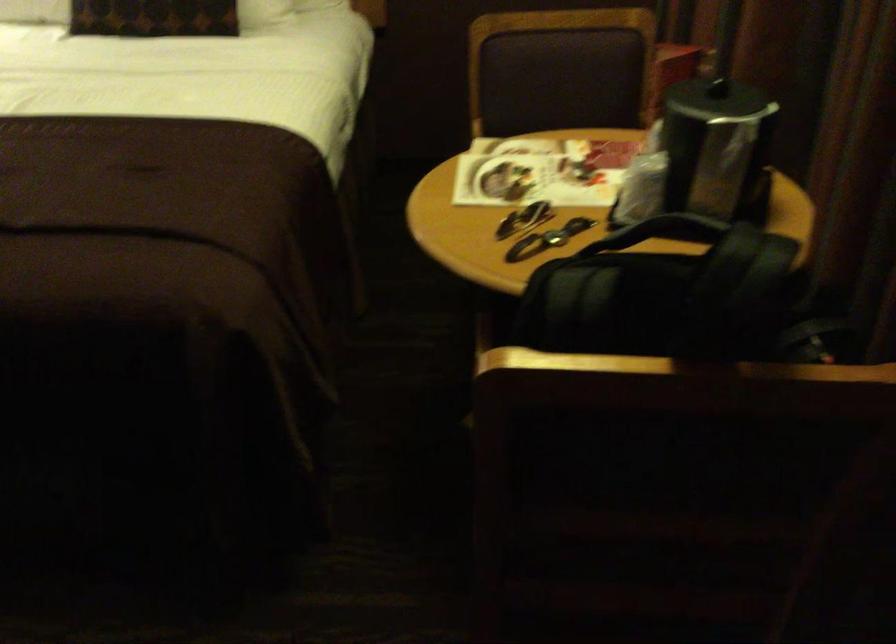
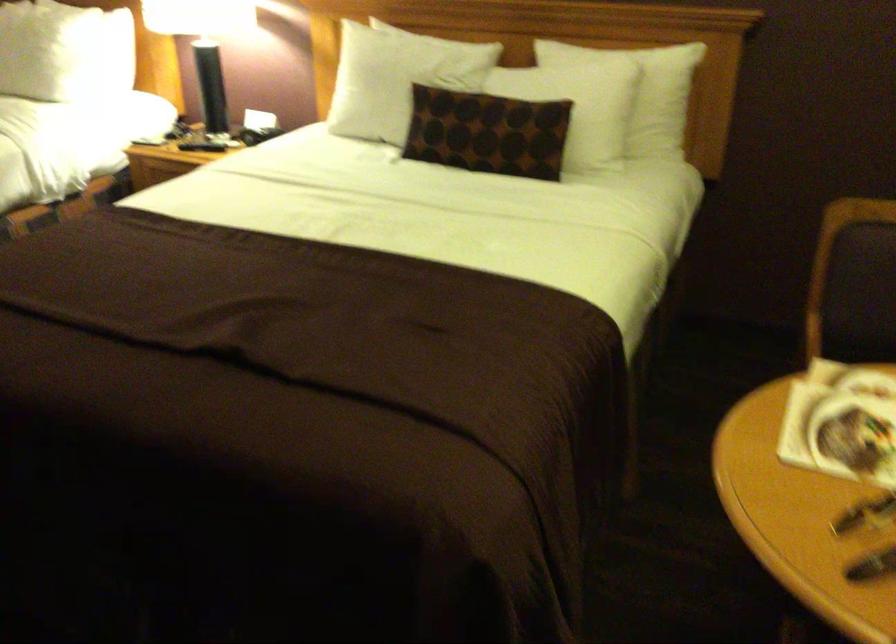
The images are taken continuously from a first-person perspective. In which direction are you moving?

The cameraman moved toward left, forward.